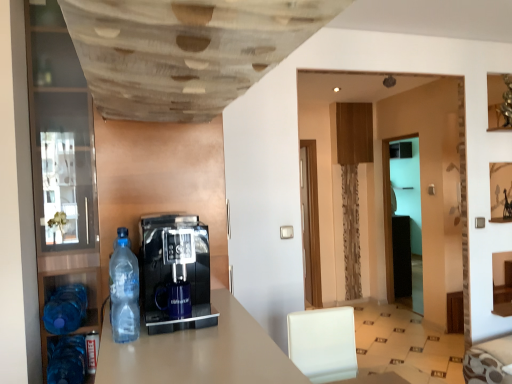
Question: Is transparent glass door at center wider or thinner than blue plastic bottle at lower left, placed as the second bottle when sorted from bottom to top?

Choices:
 (A) wide
 (B) thin

Answer: (B)

Question: Is transparent glass door at center to the left or to the right of blue plastic bottle at lower left, the second bottle in the top-to-bottom sequence, in the image?

Choices:
 (A) left
 (B) right

Answer: (B)

Question: Which is farther from the blue plastic bottle at lower left, placed as the second bottle when sorted from bottom to top?

Choices:
 (A) transparent plastic bottle at left, the 3th bottle from the back
 (B) transparent glass pantry at left
 (C) wooden textured ceiling at upper center
 (D) transparent glass door at center
 (E) blue plastic bottle at lower left, which is the 1th bottle from bottom to top

Answer: (D)

Question: Considering the real-world distances, which object is closest to the blue plastic bottle at lower left, which is the third bottle in front-to-back order?

Choices:
 (A) wooden textured ceiling at upper center
 (B) transparent glass door at center
 (C) blue plastic bottle at lower left, marked as the second bottle in a front-to-back arrangement
 (D) transparent glass pantry at left
 (E) transparent plastic bottle at left, marked as the 3th bottle in a bottom-to-top arrangement

Answer: (C)